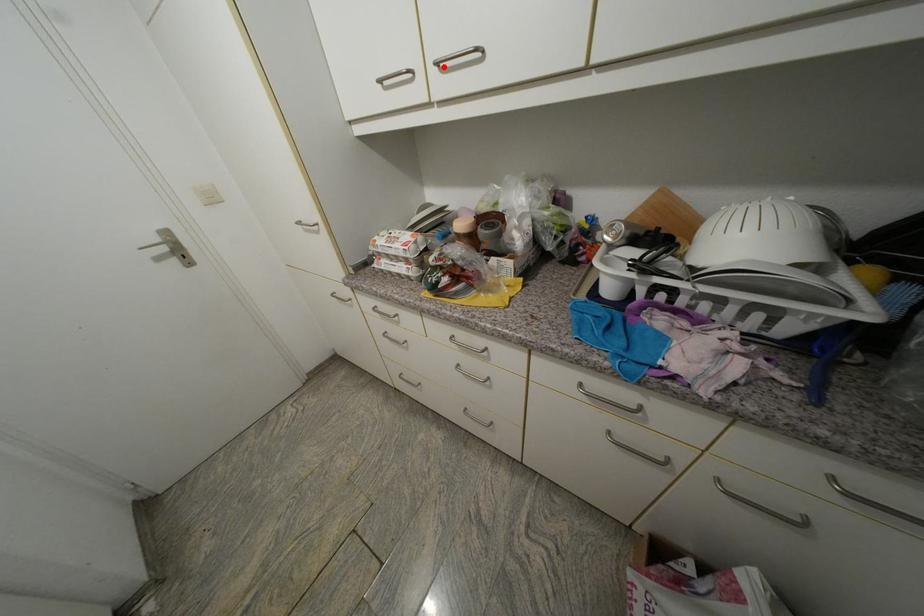
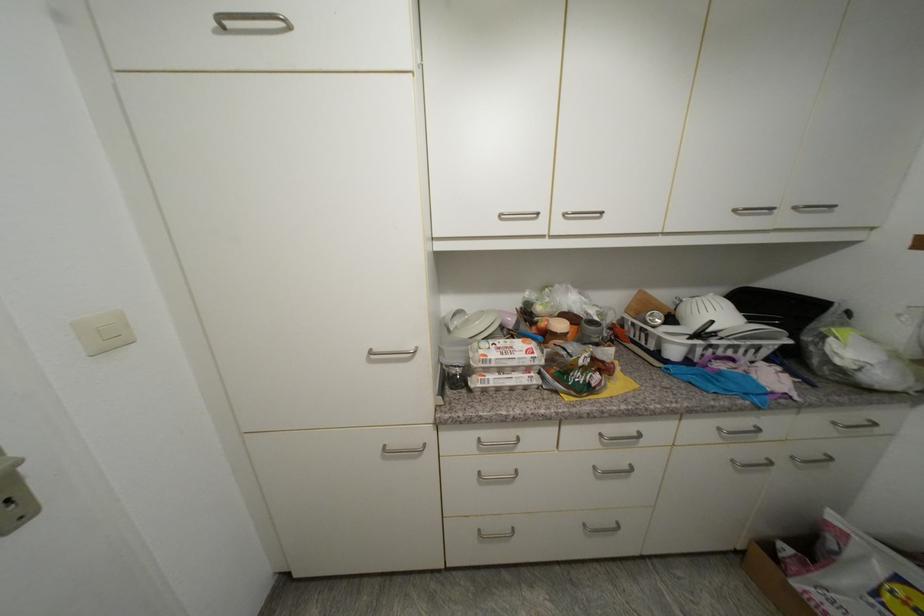
The point at the highlighted location is marked in the first image. Where is the corresponding point in the second image?

(570, 216)